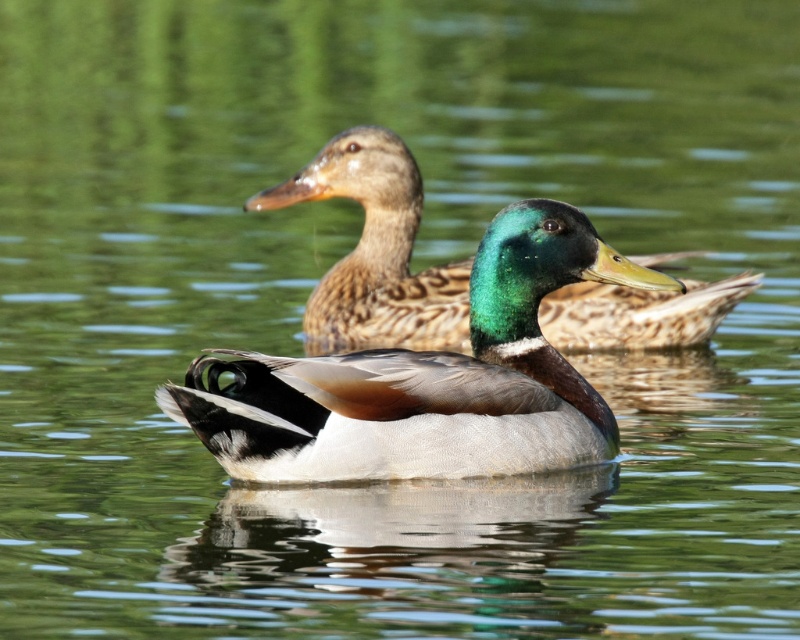
Question: Which point is closer to the camera?

Choices:
 (A) shiny green head at center
 (B) green glossy head at center

Answer: (A)

Question: Is shiny green head at center thinner than green glossy head at center?

Choices:
 (A) no
 (B) yes

Answer: (A)

Question: Which object appears closest to the camera in this image?

Choices:
 (A) green glossy head at center
 (B) shiny green head at center

Answer: (B)

Question: Does shiny green head at center have a larger size compared to green glossy head at center?

Choices:
 (A) yes
 (B) no

Answer: (A)

Question: Can you confirm if shiny green head at center is wider than green glossy head at center?

Choices:
 (A) no
 (B) yes

Answer: (B)

Question: Which point is farther to the camera?

Choices:
 (A) (416, 317)
 (B) (364, 467)

Answer: (A)